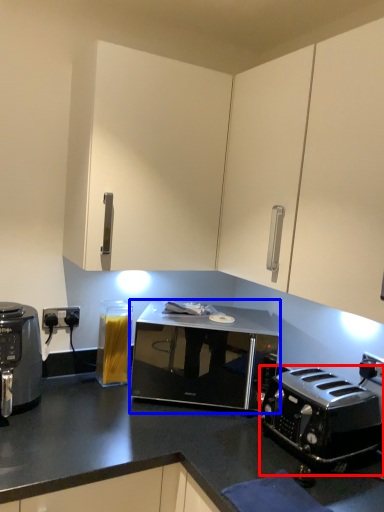
Question: Which object appears farthest to the camera in this image, toaster (highlighted by a red box) or microwave oven (highlighted by a blue box)?

Choices:
 (A) toaster
 (B) microwave oven

Answer: (B)